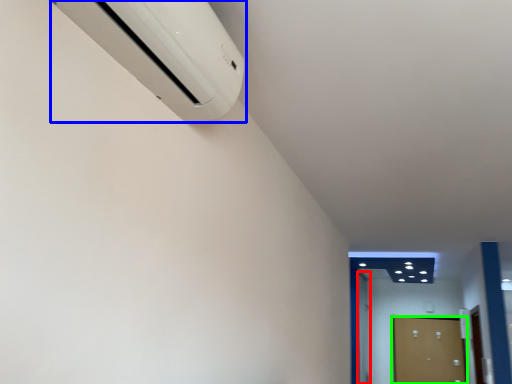
Question: Considering the real-world distances, which object is closest to door (highlighted by a red box)? home appliance (highlighted by a blue box) or door (highlighted by a green box).

Choices:
 (A) home appliance
 (B) door

Answer: (B)